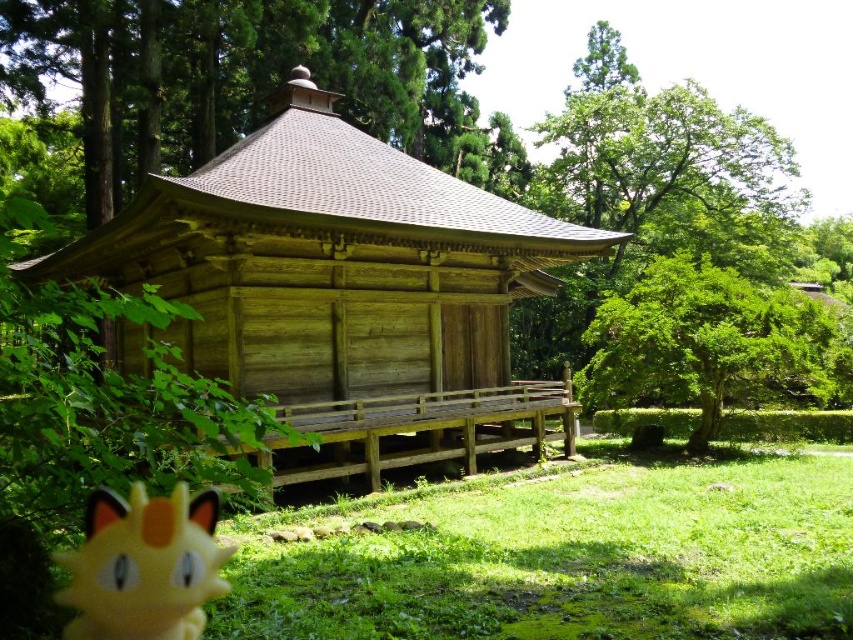
You are a visitor in this peaceful outdoor area and want to place the yellow plush toy at lower left near the green leafy tree at center. Considering their sizes, which one takes up more space in the scene?

The green leafy tree at center has a larger size compared to the yellow plush toy at lower left, so the green leafy tree at center takes up more space in the scene.

You are standing at the entrance of the wooden pavilion and want to place the yellow plush toy at lower left on a higher surface. Is the green textured tree at upper left a suitable spot for placing the toy?

The green textured tree at upper left is located above the yellow plush toy at lower left, so it is a higher surface. However, trees are not typically stable surfaces for placing objects like plush toys. Consider finding a more secure location like a bench or a flat surface.